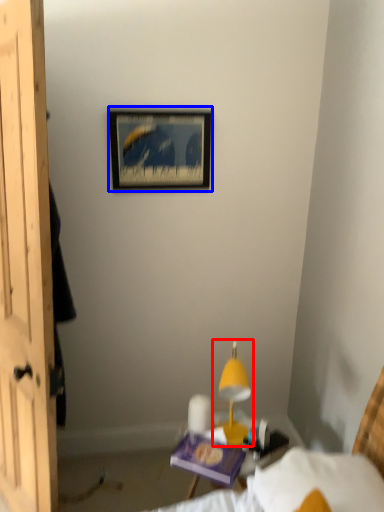
Question: Among these objects, which one is nearest to the camera, table lamp (highlighted by a red box) or picture frame (highlighted by a blue box)?

Choices:
 (A) table lamp
 (B) picture frame

Answer: (A)